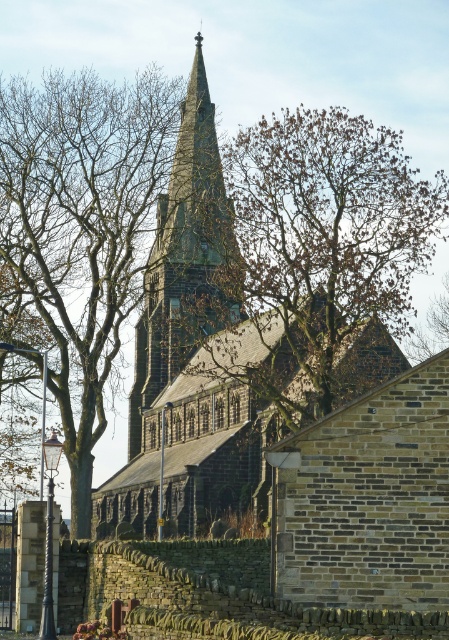
Question: Can you confirm if brown leafy tree at center is positioned above dark gray stone steeple at center?

Choices:
 (A) yes
 (B) no

Answer: (B)

Question: Can you confirm if brown leafy tree at center is positioned above dark gray stone steeple at center?

Choices:
 (A) no
 (B) yes

Answer: (A)

Question: Which of the following is the farthest from the observer?

Choices:
 (A) (57, 221)
 (B) (352, 305)

Answer: (A)

Question: Is bare branches at center below dark gray stone steeple at center?

Choices:
 (A) no
 (B) yes

Answer: (B)

Question: Which is farther from the bare branches at center?

Choices:
 (A) dark gray stone steeple at center
 (B) brown leafy tree at center

Answer: (B)

Question: Among these objects, which one is farthest from the camera?

Choices:
 (A) dark gray stone steeple at center
 (B) bare branches at center

Answer: (A)